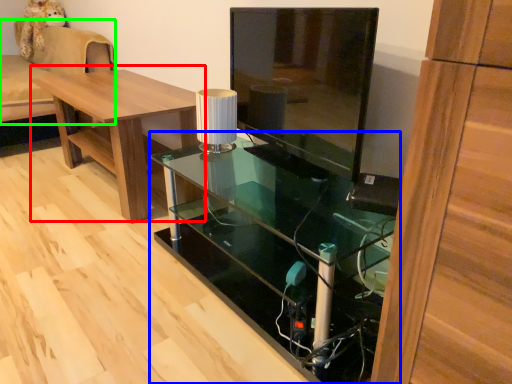
Question: Which is farther away from table (highlighted by a red box)? desk (highlighted by a blue box) or couch (highlighted by a green box)?

Choices:
 (A) desk
 (B) couch

Answer: (B)